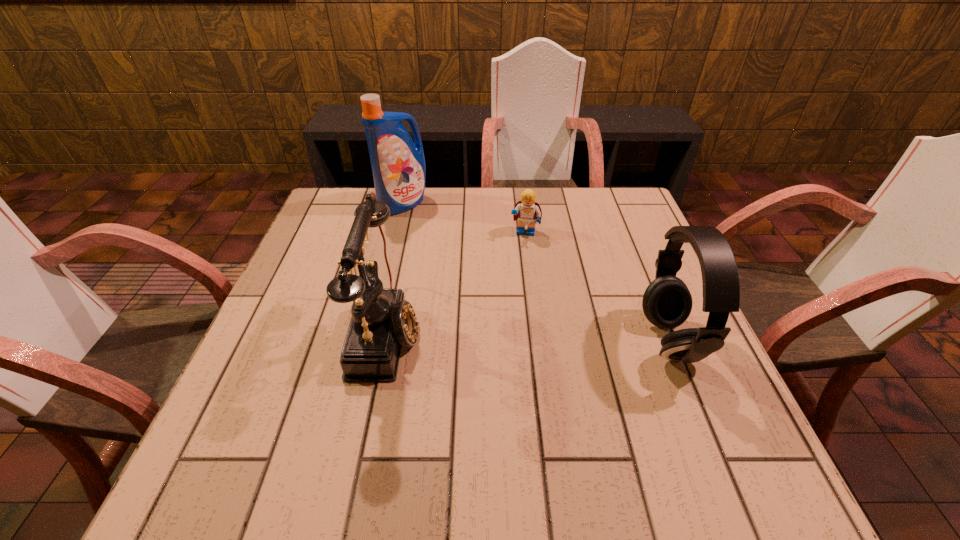
Where is `free spot on the desktop that is between the telephone and the earphone and is positioned on the front-facing side of the Lego`? This screenshot has height=540, width=960. free spot on the desktop that is between the telephone and the earphone and is positioned on the front-facing side of the Lego is located at coordinates (507, 335).

Where is `vacant space on the desktop that is between the telephone and the earphone and is positioned on the label of the detergent`? The image size is (960, 540). vacant space on the desktop that is between the telephone and the earphone and is positioned on the label of the detergent is located at coordinates (492, 335).